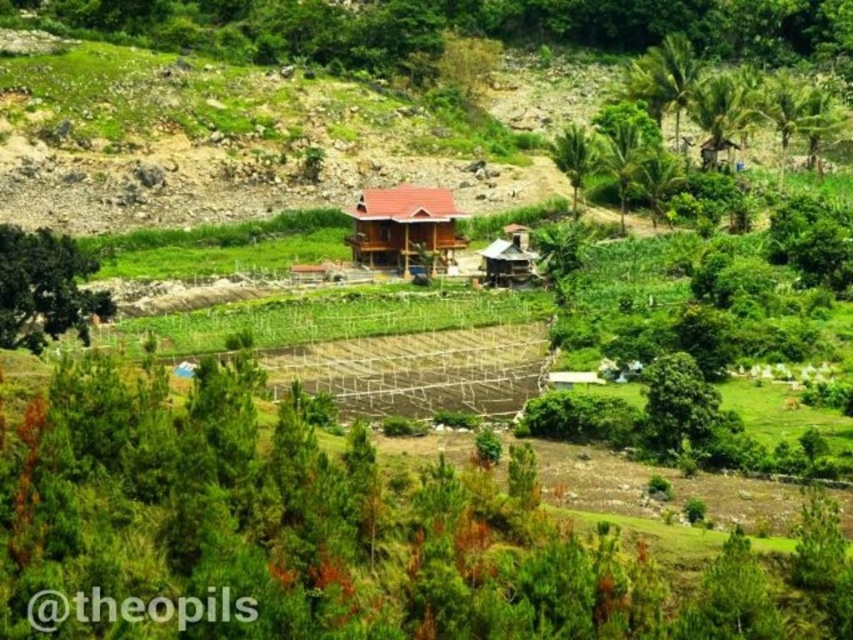
You are standing at the base of the green grassy hillside at upper center and want to reach the brown wooden hut at center. Which direction should you walk to get there?

You should walk downward towards the brown wooden hut at center because the green grassy hillside at upper center is located above it.

You are planning to build a small garden between the green grassy hillside at upper center and the brown wooden hut at center. Which area has more space available for gardening?

The green grassy hillside at upper center has more space available for gardening since its width is larger than the brown wooden hut at center.